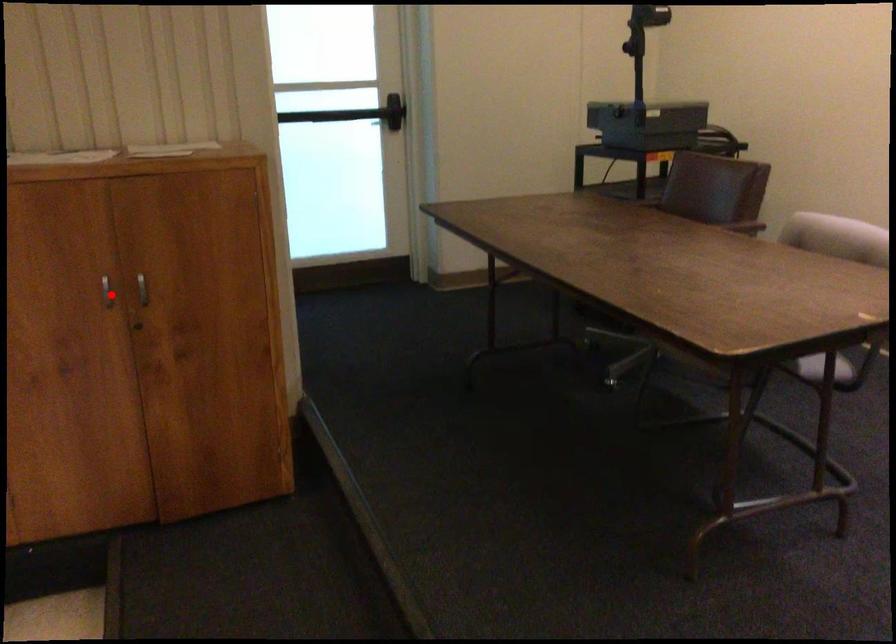
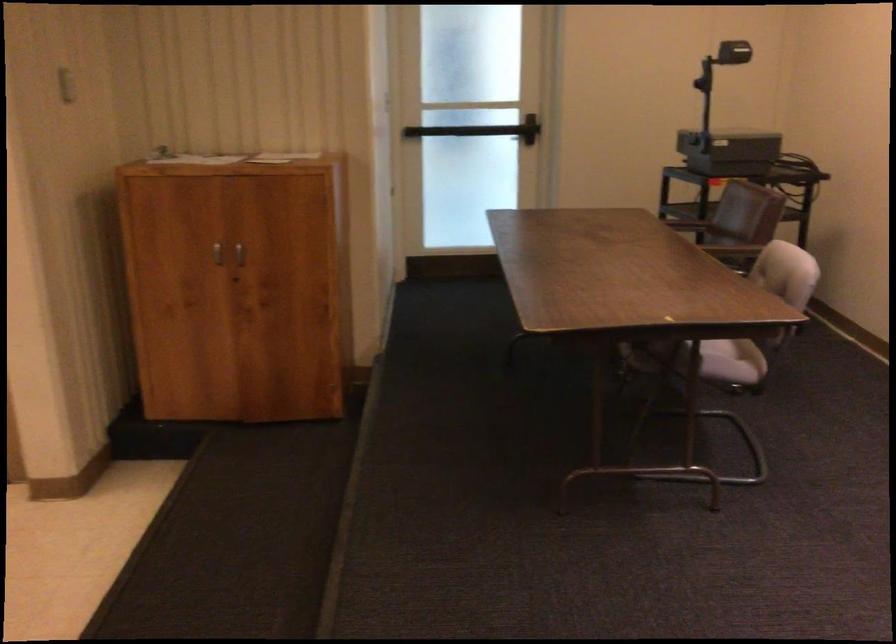
Where in the second image is the point corresponding to the highlighted location from the first image?

(217, 252)